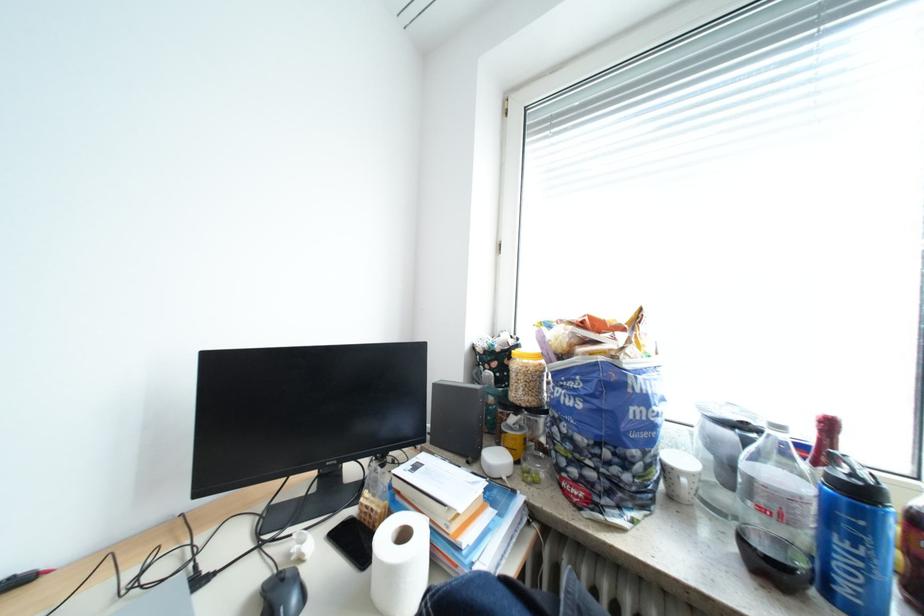
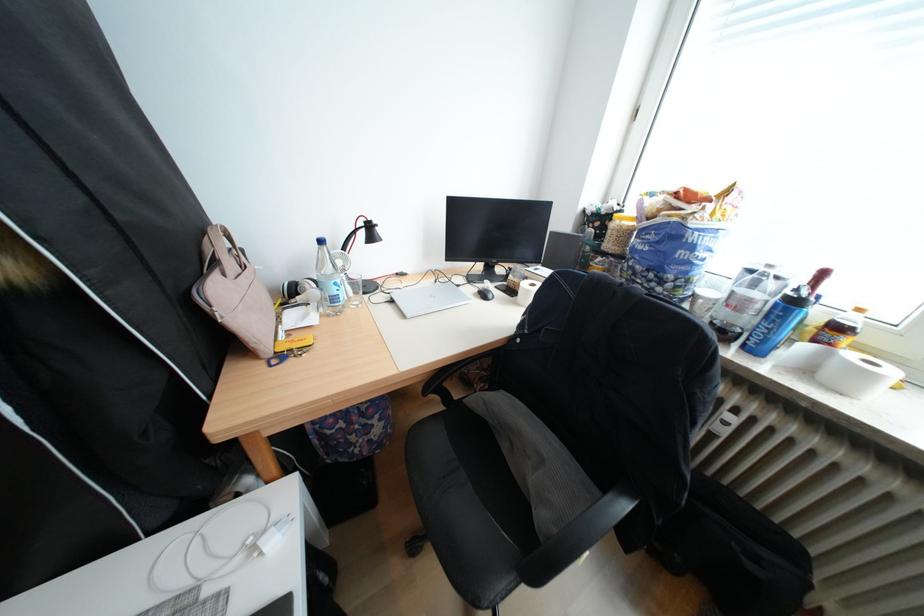
Where in the second image is the point corresponding to the point at 873,493 from the first image?

(808, 302)